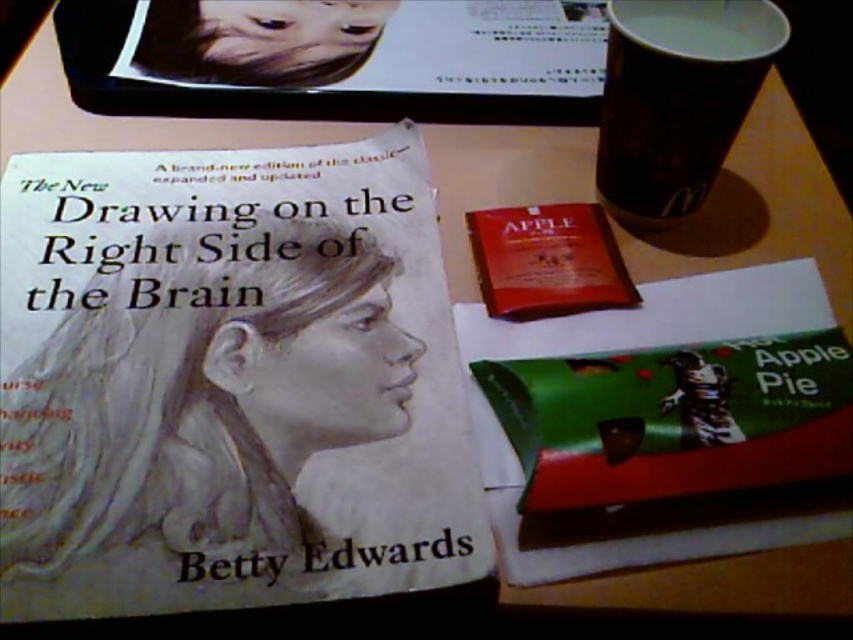
Question: Is green matte hot apple pie at center in front of white paper cup at upper right?

Choices:
 (A) no
 (B) yes

Answer: (B)

Question: Which object is farther from the camera taking this photo?

Choices:
 (A) matte white book at center
 (B) white paper cup at upper right
 (C) matte red packet at center
 (D) green matte hot apple pie at center

Answer: (C)

Question: Estimate the real-world distances between objects in this image. Which object is farther from the matte red packet at center?

Choices:
 (A) green matte hot apple pie at center
 (B) matte white book at center
 (C) white paper cup at upper right

Answer: (B)

Question: Does matte white book at center come behind matte red packet at center?

Choices:
 (A) no
 (B) yes

Answer: (A)

Question: Is green matte hot apple pie at center below white paper cup at upper right?

Choices:
 (A) no
 (B) yes

Answer: (B)

Question: Which point is farther to the camera?

Choices:
 (A) matte white book at center
 (B) matte red packet at center
 (C) green matte hot apple pie at center

Answer: (B)